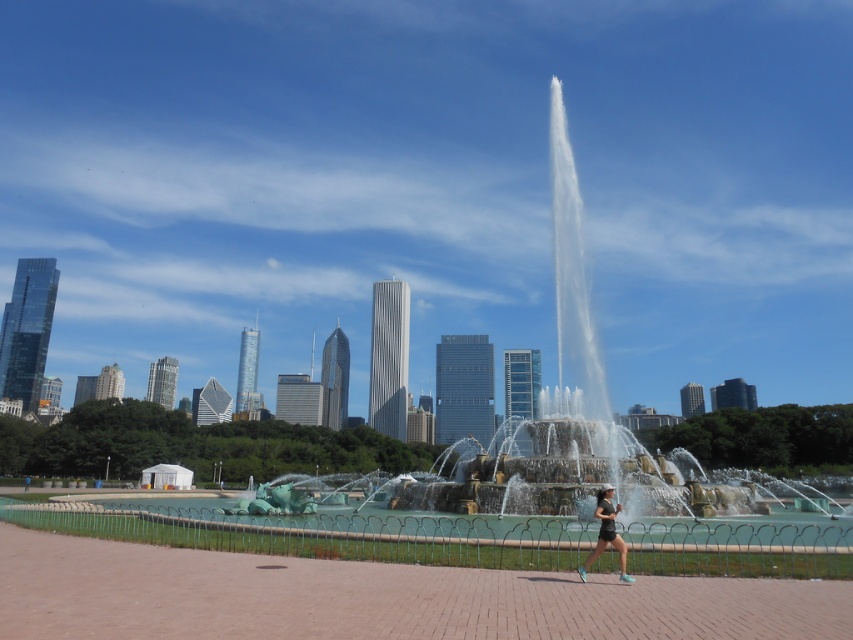
Can you confirm if green patina fountain at center is taller than matte black shorts at center?

Yes.

Is green patina fountain at center to the left of matte black shorts at center from the viewer's perspective?

Correct, you'll find green patina fountain at center to the left of matte black shorts at center.

Which is behind, point (556, 355) or point (616, 538)?

Positioned behind is point (556, 355).

Identify the location of green patina fountain at center. The width and height of the screenshot is (853, 640). (572, 285).